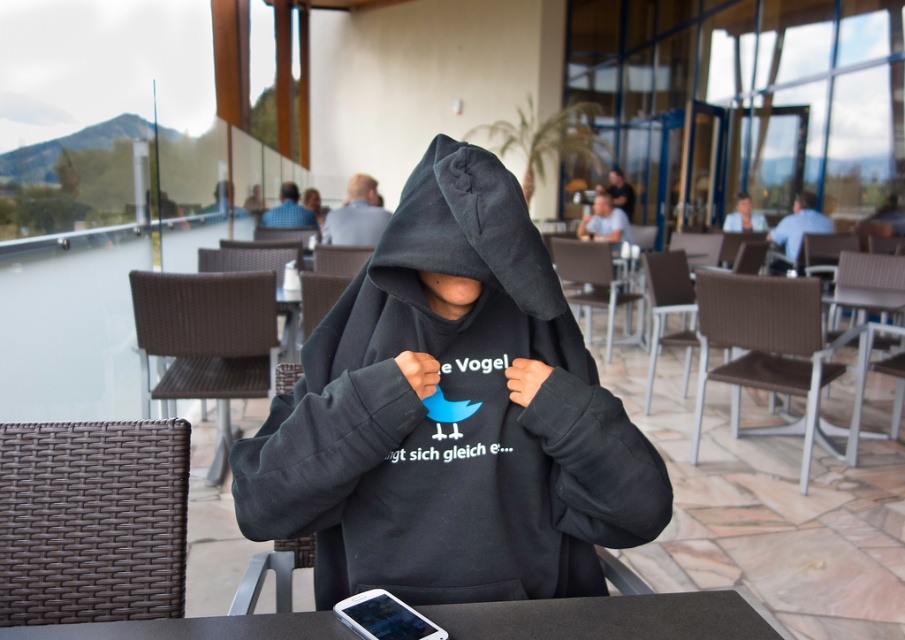
Question: Which object is closer to the camera taking this photo?

Choices:
 (A) blue shirt at upper right
 (B) black fleece hoodie at center
 (C) smooth skin face at upper right
 (D) dark gray hoodie at center

Answer: (B)

Question: Can you confirm if black fleece hoodie at center is positioned above smooth skin face at upper right?

Choices:
 (A) no
 (B) yes

Answer: (A)

Question: Can you confirm if black fleece hoodie at center is positioned below blue shirt at upper right?

Choices:
 (A) yes
 (B) no

Answer: (A)

Question: Is dark gray hoodie at center wider than smooth skin face at upper right?

Choices:
 (A) no
 (B) yes

Answer: (A)

Question: Which point appears closest to the camera in this image?

Choices:
 (A) (298, 211)
 (B) (433, 212)

Answer: (B)

Question: Which point appears closest to the camera in this image?

Choices:
 (A) (602, 616)
 (B) (434, 214)

Answer: (B)